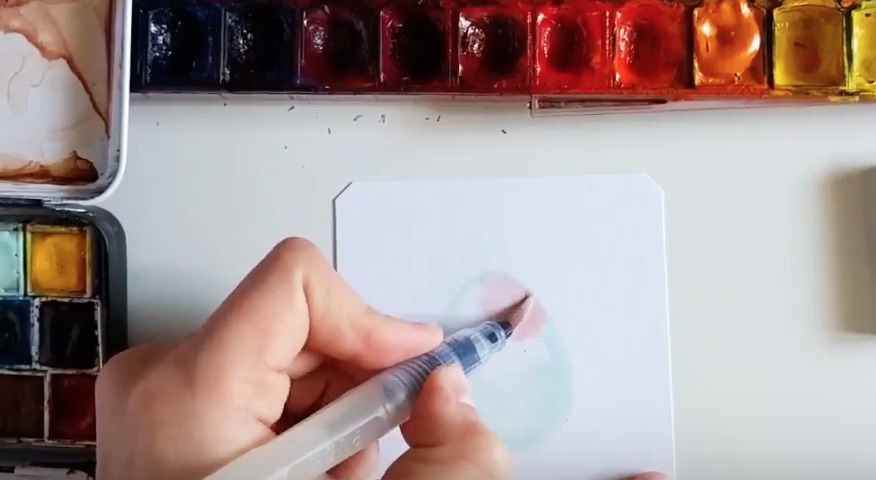
Where is `white desk surface`? white desk surface is located at coordinates (806, 307).